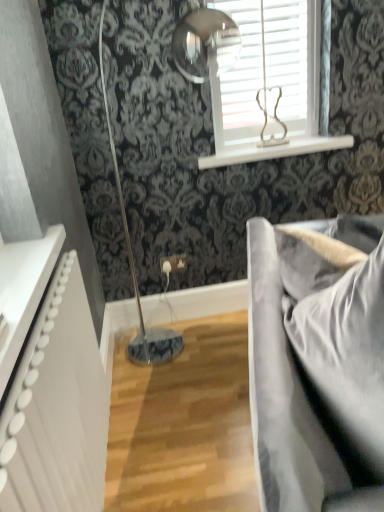
This screenshot has height=512, width=384. I want to click on vacant space situated above white textured radiator at left (from a real-world perspective), so click(40, 325).